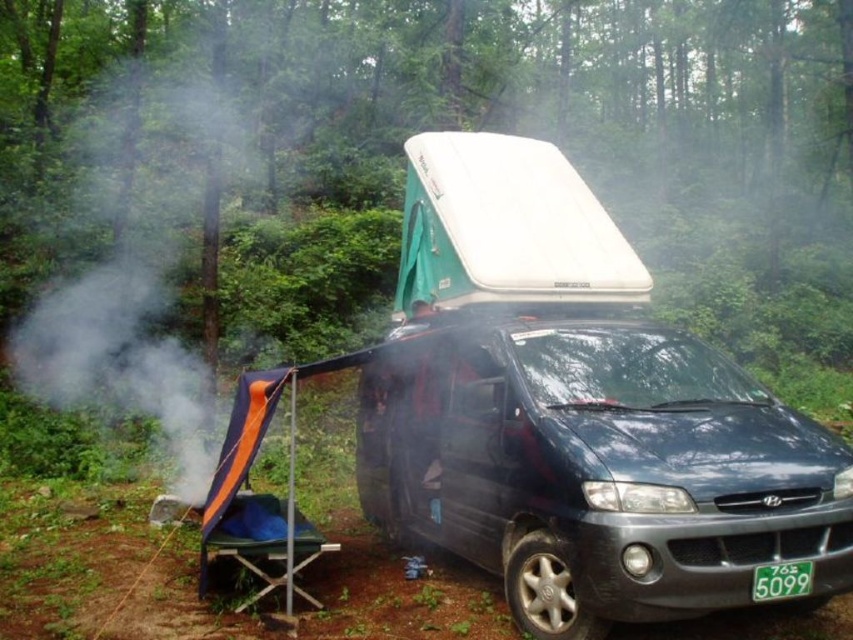
Can you confirm if matte black van at center is positioned above green plastic license plate at lower right?

Indeed, matte black van at center is positioned over green plastic license plate at lower right.

Is point (840, 451) less distant than point (790, 572)?

No, it is behind (790, 572).

Find the location of `matte black van at center`. matte black van at center is located at coordinates (599, 470).

Measure the distance between white smoke at left and camera.

They are 24.73 feet apart.

Locate an element on the screen. Image resolution: width=853 pixels, height=640 pixels. white smoke at left is located at coordinates (122, 358).

Where is `white smoke at left`? The height and width of the screenshot is (640, 853). white smoke at left is located at coordinates (122, 358).

Is orange fabric chair at lower left taller than green plastic license plate at lower right?

Yes, orange fabric chair at lower left is taller than green plastic license plate at lower right.

Who is taller, orange fabric chair at lower left or green plastic license plate at lower right?

orange fabric chair at lower left

Between point (308, 552) and point (784, 586), which one is positioned behind?

Positioned behind is point (308, 552).

The width and height of the screenshot is (853, 640). In order to click on orange fabric chair at lower left in this screenshot , I will do `click(263, 541)`.